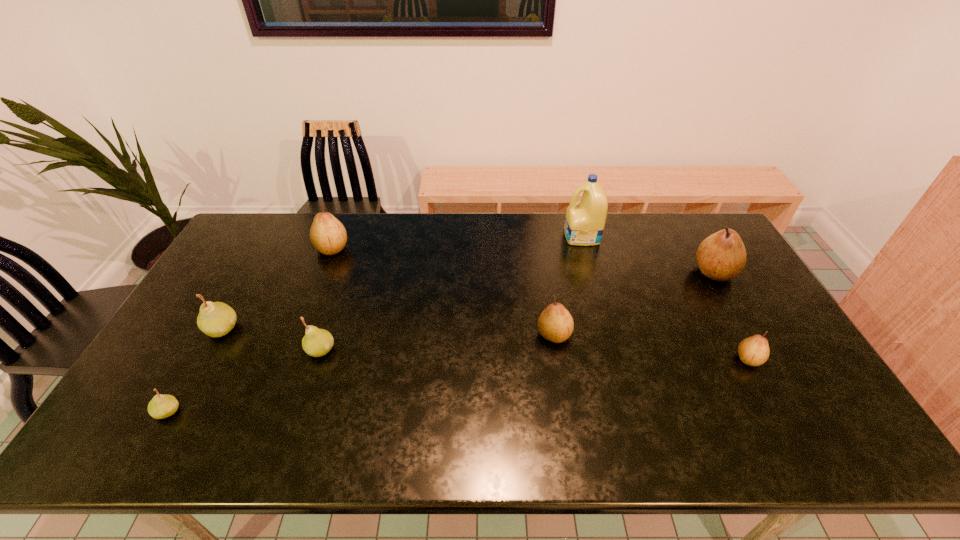
Identify the location of free point at the near left corner. (133, 424).

Find the location of a particular element. blank space at the far right corner of the desktop is located at coordinates (690, 224).

This screenshot has width=960, height=540. I want to click on empty space that is in between the second tallest object and the biggest green pear, so click(x=468, y=300).

At what (x,y) coordinates should I click in order to perform the action: click on free space between the second biggest brown pear and the nearest green pear. Please return your answer as a coordinate pair (x, y). The width and height of the screenshot is (960, 540). Looking at the image, I should click on (250, 330).

Where is `free spot between the third smallest brown pear and the biggest green pear`? free spot between the third smallest brown pear and the biggest green pear is located at coordinates (277, 289).

Find the location of `vacant area between the biggest green pear and the biggest brown pear`. vacant area between the biggest green pear and the biggest brown pear is located at coordinates (468, 300).

Image resolution: width=960 pixels, height=540 pixels. I want to click on free area in between the smallest brown pear and the rightmost green pear, so click(x=535, y=354).

This screenshot has height=540, width=960. I want to click on vacant area that lies between the leftmost brown pear and the biggest green pear, so click(277, 289).

The width and height of the screenshot is (960, 540). I want to click on vacant area that lies between the smallest brown pear and the second biggest brown pear, so click(x=540, y=303).

Locate an element on the screen. free space between the biggest green pear and the nearest green pear is located at coordinates (195, 370).